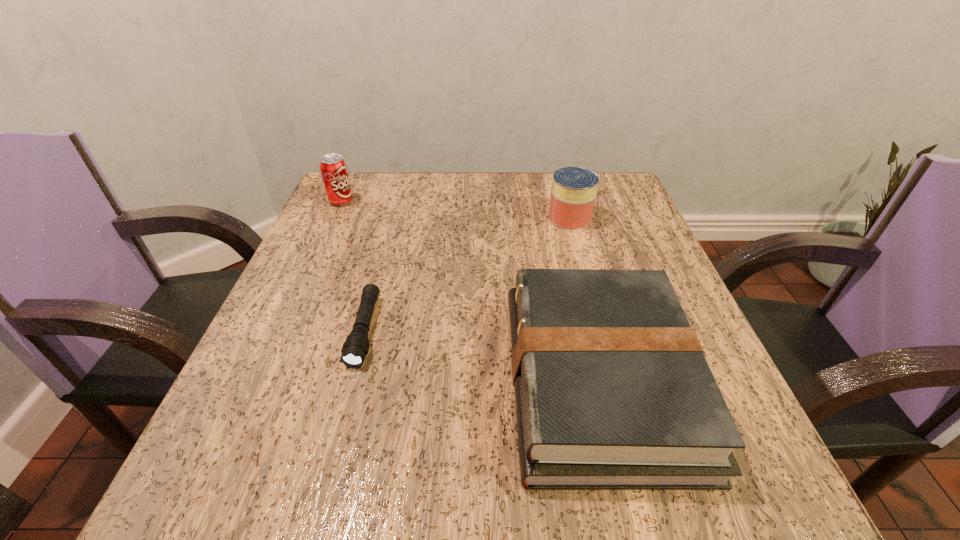
Identify the location of free space that is in between the soda and the hardback book. Image resolution: width=960 pixels, height=540 pixels. (470, 291).

The width and height of the screenshot is (960, 540). I want to click on free space that is in between the second object from left to right and the soda, so click(x=353, y=266).

Locate an element on the screen. The height and width of the screenshot is (540, 960). unoccupied area between the leftmost object and the flashlight is located at coordinates point(353,266).

Identify the location of blank region between the hardback book and the shortest object. (482, 355).

You are a GUI agent. You are given a task and a screenshot of the screen. Output one action in this format:
    pyautogui.click(x=<x>, y=<y>)
    Task: Click on the free spot between the hardback book and the shortest object
    The image size is (960, 540).
    Given the screenshot: What is the action you would take?
    pyautogui.click(x=482, y=355)

Where is `empty space that is in between the soda and the flashlight`? The height and width of the screenshot is (540, 960). empty space that is in between the soda and the flashlight is located at coordinates (353, 266).

Identify the location of object that is the third nearest to the second object from left to right. (574, 189).

Locate an element on the screen. object that is the nearest to the leftmost object is located at coordinates (355, 348).

Image resolution: width=960 pixels, height=540 pixels. Identify the location of vacant point that satisfies the following two spatial constraints: 1. on the front side of the can; 2. on the spine side of the hardback book. (614, 380).